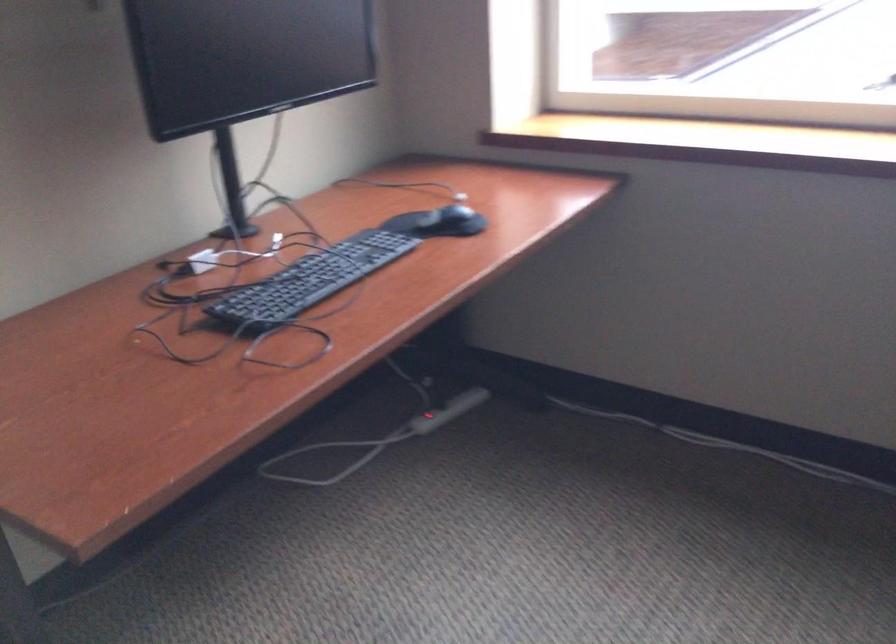
This screenshot has height=644, width=896. Find the location of `black keyboard`. black keyboard is located at coordinates (307, 281).